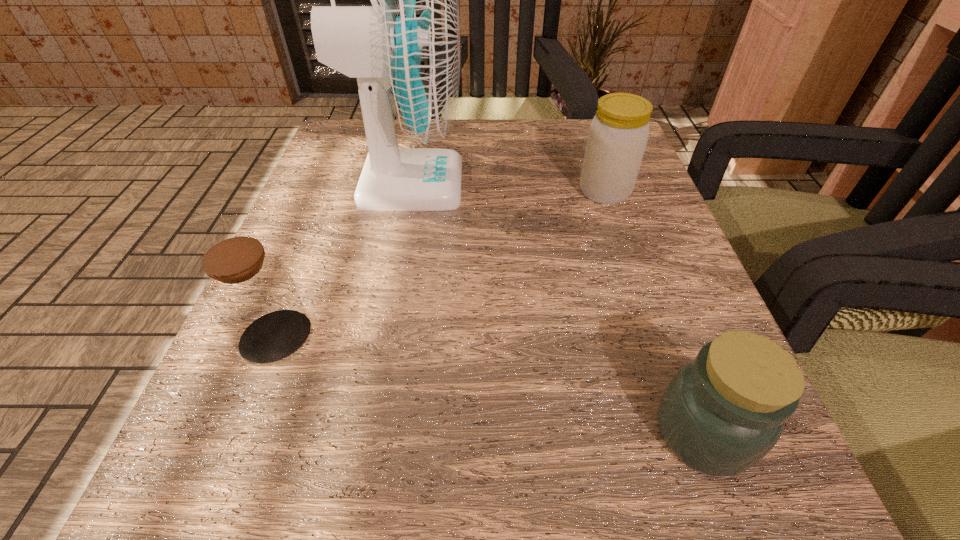
Where is `vacant space at the right edge of the desktop`? This screenshot has height=540, width=960. vacant space at the right edge of the desktop is located at coordinates (584, 272).

You are a GUI agent. You are given a task and a screenshot of the screen. Output one action in this format:
    pyautogui.click(x=<x>, y=<y>)
    Task: Click on the free space at the far left corner of the desktop
    This screenshot has height=540, width=960.
    Given the screenshot: What is the action you would take?
    pyautogui.click(x=363, y=124)

This screenshot has width=960, height=540. I want to click on vacant space at the far right corner, so click(x=579, y=128).

In the image, there is a desktop. Identify the location of vacant space at the near right corner. The height and width of the screenshot is (540, 960). pyautogui.click(x=681, y=493).

Image resolution: width=960 pixels, height=540 pixels. Identify the location of vacant space that is in between the nearest object and the tallest object. (556, 308).

The width and height of the screenshot is (960, 540). Find the location of `free spot between the farthest jar and the tallest object`. free spot between the farthest jar and the tallest object is located at coordinates (507, 187).

The image size is (960, 540). What are the coordinates of `vacant region between the tallest object and the second farthest jar` in the screenshot? It's located at (343, 260).

The width and height of the screenshot is (960, 540). Identify the location of free spot between the farthest jar and the nearest object. (654, 312).

Where is `free spot between the leftmost jar and the nearest jar`? The height and width of the screenshot is (540, 960). free spot between the leftmost jar and the nearest jar is located at coordinates (490, 384).

This screenshot has height=540, width=960. What are the coordinates of `empty space between the tallest object and the nearest jar` in the screenshot? It's located at (556, 308).